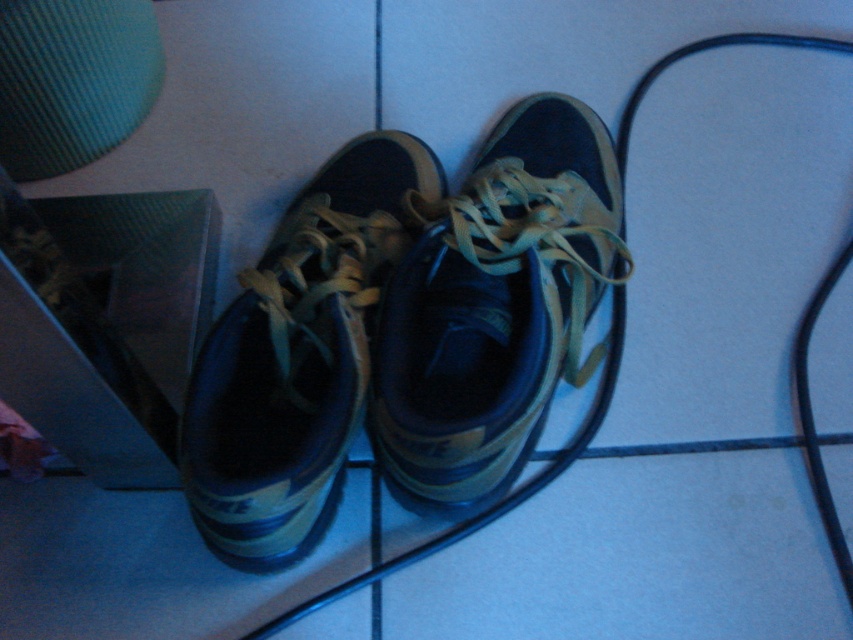
You are organizing a shoe display and need to place the matte black sneaker at center and the matte blue sneaker at center side by side. Which sneaker should you place on the left to ensure they fit within a 1.2 meter wide shelf?

The matte blue sneaker at center should be placed on the left since it is smaller than the matte black sneaker at center, allowing both to fit within the 1.2 meter wide shelf.

You are organizing your closet and see the matte black sneaker at center and the matte blue sneaker at center. Which sneaker is covering part of the other one?

The matte black sneaker at center is positioned over the matte blue sneaker at center, so it is covering part of it.

You are standing in a room with a pair of matte black sneakers placed on the floor. There is a black curved cable nearby. If you want to avoid stepping on the sneakers, which direction should you move relative to the point marked by the coordinates point (496,305)?

To avoid stepping on the matte black sneaker at center represented by point (496,305), you should move away from that point in any direction except directly onto it.